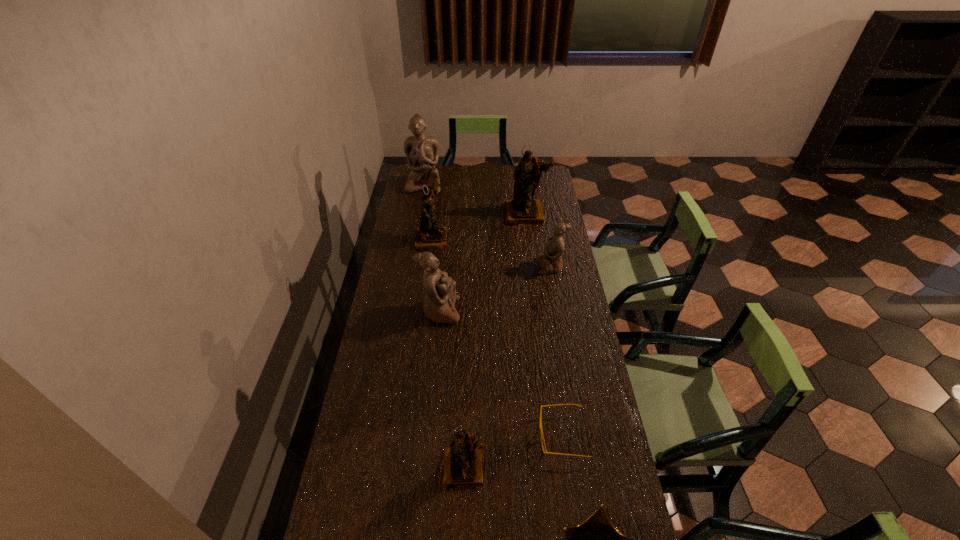
In order to click on the nearest figurine in this screenshot , I will do `click(463, 463)`.

What are the coordinates of `the smallest gold figurine` in the screenshot? It's located at (463, 463).

At what (x,y) coordinates should I click in order to perform the action: click on spectacles. Please return your answer as a coordinate pair (x, y). The image size is (960, 540). Looking at the image, I should click on (542, 436).

The width and height of the screenshot is (960, 540). In order to click on beige spectacles in this screenshot , I will do `click(542, 436)`.

The width and height of the screenshot is (960, 540). What are the coordinates of `vacant area situated 0.340m on the front-facing side of the farthest object` in the screenshot? It's located at (416, 234).

The image size is (960, 540). I want to click on free spot located 0.230m on the front-facing side of the biggest gold figurine, so click(x=532, y=256).

Locate an element on the screen. Image resolution: width=960 pixels, height=540 pixels. free space located 0.340m on the front-facing side of the second smallest gold figurine is located at coordinates (521, 239).

Find the location of a particular element. free space located on the front-facing side of the fourth nearest object is located at coordinates (562, 311).

In order to click on free space located on the front-facing side of the smallest white figurine in this screenshot , I will do `click(471, 266)`.

You are a GUI agent. You are given a task and a screenshot of the screen. Output one action in this format:
    pyautogui.click(x=<x>, y=<y>)
    Task: Click on the free location located on the front-facing side of the smallest white figurine
    
    Given the screenshot: What is the action you would take?
    pyautogui.click(x=488, y=266)